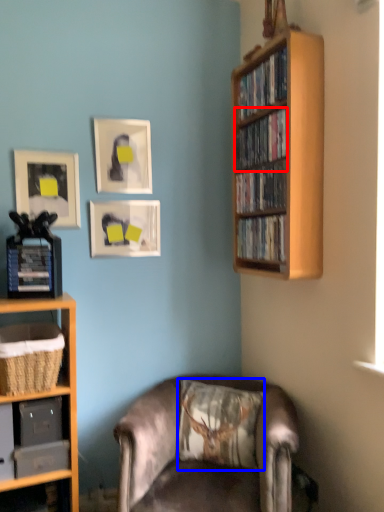
Question: Which point is further to the camera, book (highlighted by a red box) or pillow (highlighted by a blue box)?

Choices:
 (A) book
 (B) pillow

Answer: (B)